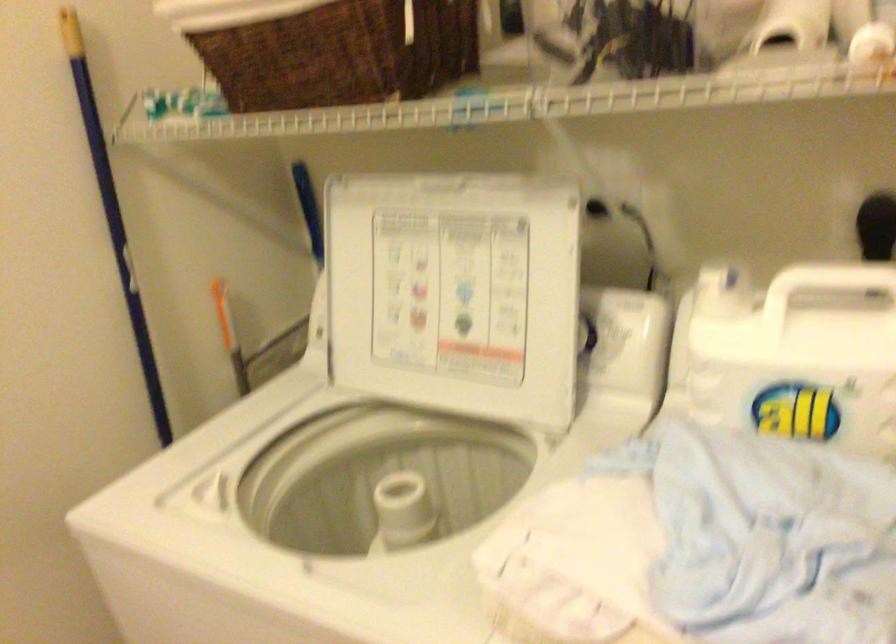
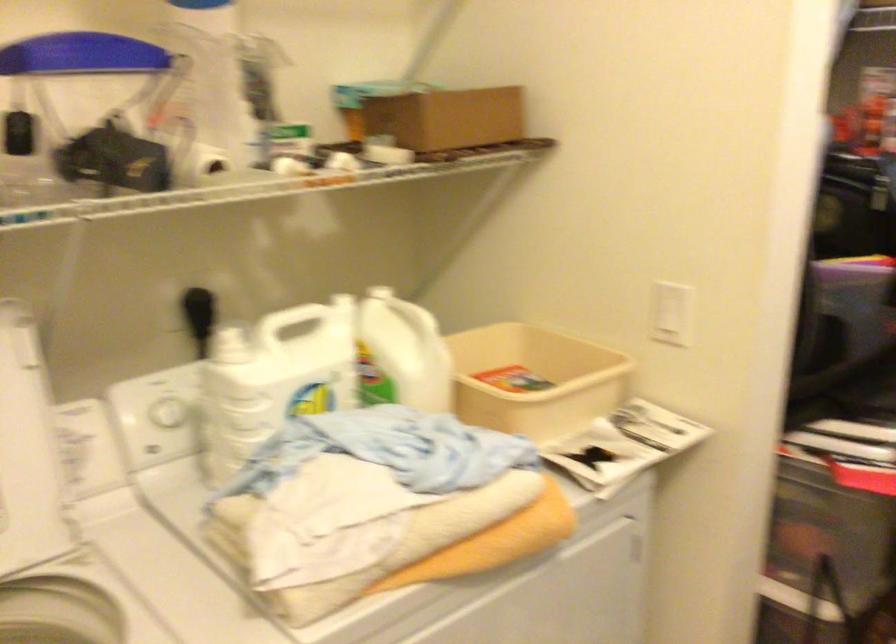
Where in the second image is the point corresponding to pixel 719 344 from the first image?

(168, 412)